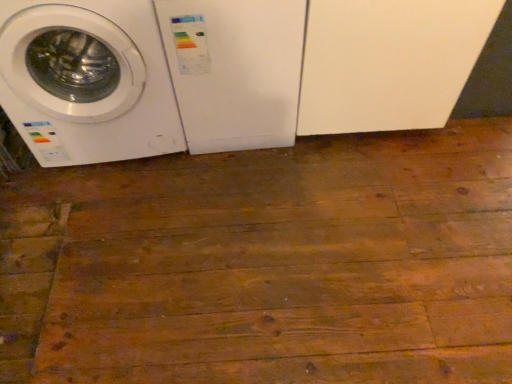
Question: Is white glossy washing machine at left, which ranks as the 1th washing machine in left-to-right order, touching white plastic washing machine at center, which is the first washing machine from right to left?

Choices:
 (A) no
 (B) yes

Answer: (A)

Question: From a real-world perspective, is white glossy washing machine at left, which ranks as the 1th washing machine in left-to-right order, over white plastic washing machine at center, the 2th washing machine viewed from the left?

Choices:
 (A) yes
 (B) no

Answer: (A)

Question: From a real-world perspective, is white glossy washing machine at left, positioned as the second washing machine in right-to-left order, physically below white plastic washing machine at center, which is the first washing machine from right to left?

Choices:
 (A) no
 (B) yes

Answer: (A)

Question: Is white plastic washing machine at center, the 2th washing machine viewed from the left, located within white glossy washing machine at left, which ranks as the 1th washing machine in left-to-right order?

Choices:
 (A) yes
 (B) no

Answer: (B)

Question: Is white glossy washing machine at left, positioned as the second washing machine in right-to-left order, to the right of white plastic washing machine at center, the 2th washing machine viewed from the left, from the viewer's perspective?

Choices:
 (A) yes
 (B) no

Answer: (B)

Question: Is white glossy washing machine at left, which ranks as the 1th washing machine in left-to-right order, positioned far away from white plastic washing machine at center, which is the first washing machine from right to left?

Choices:
 (A) no
 (B) yes

Answer: (A)

Question: Is white plastic washing machine at center, which is the first washing machine from right to left, not near white glossy washing machine at left, which ranks as the 1th washing machine in left-to-right order?

Choices:
 (A) no
 (B) yes

Answer: (A)

Question: Is white plastic washing machine at center, which is the first washing machine from right to left, wider than white glossy washing machine at left, which ranks as the 1th washing machine in left-to-right order?

Choices:
 (A) yes
 (B) no

Answer: (B)

Question: Can you confirm if white plastic washing machine at center, the 2th washing machine viewed from the left, is thinner than white glossy washing machine at left, which ranks as the 1th washing machine in left-to-right order?

Choices:
 (A) yes
 (B) no

Answer: (A)

Question: Is white plastic washing machine at center, the 2th washing machine viewed from the left, facing towards white glossy washing machine at left, positioned as the second washing machine in right-to-left order?

Choices:
 (A) no
 (B) yes

Answer: (A)

Question: Considering the relative sizes of white plastic washing machine at center, the 2th washing machine viewed from the left, and white glossy washing machine at left, which ranks as the 1th washing machine in left-to-right order, in the image provided, is white plastic washing machine at center, the 2th washing machine viewed from the left, smaller than white glossy washing machine at left, which ranks as the 1th washing machine in left-to-right order,?

Choices:
 (A) no
 (B) yes

Answer: (B)

Question: From a real-world perspective, is white plastic washing machine at center, the 2th washing machine viewed from the left, located higher than white glossy washing machine at left, positioned as the second washing machine in right-to-left order?

Choices:
 (A) no
 (B) yes

Answer: (A)

Question: From the image's perspective, is white plastic washing machine at center, which is the first washing machine from right to left, positioned above or below white glossy washing machine at left, which ranks as the 1th washing machine in left-to-right order?

Choices:
 (A) below
 (B) above

Answer: (B)